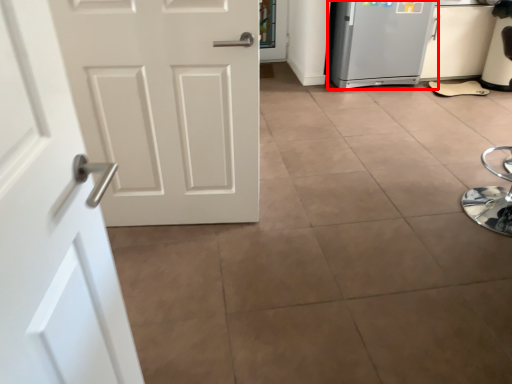
Question: From the image's perspective, where is refrigerator (annotated by the red box) located in relation to door in the image?

Choices:
 (A) below
 (B) above

Answer: (B)